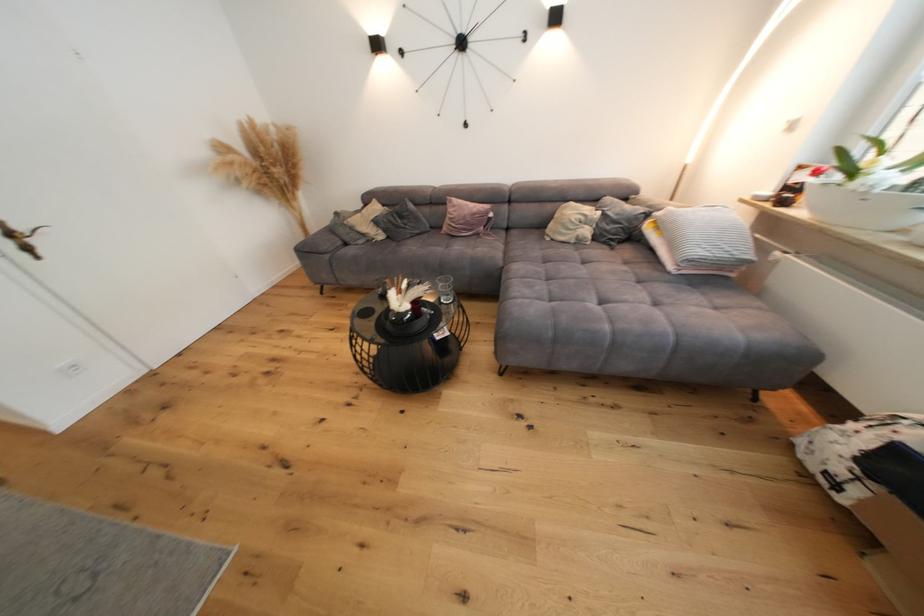
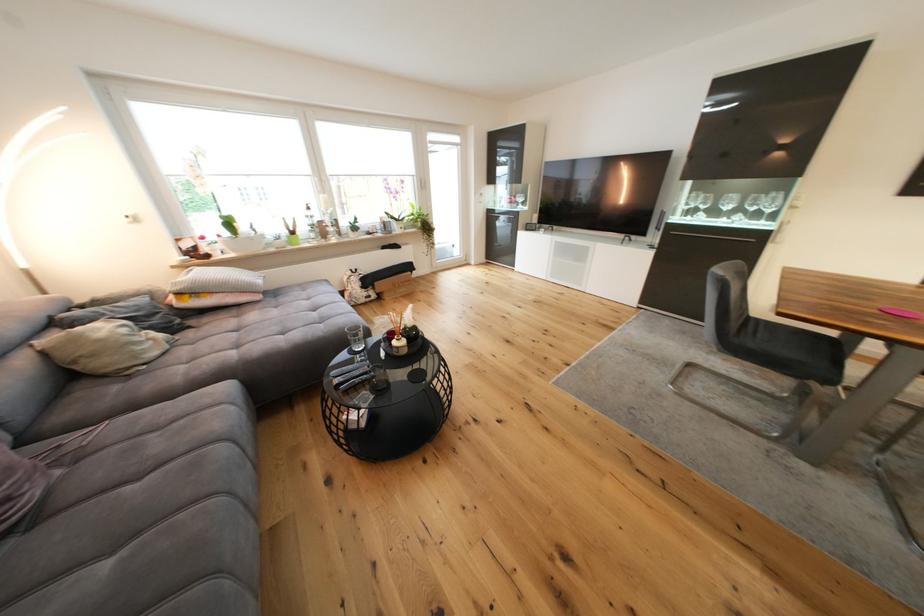
The point at (473, 225) is marked in the first image. Where is the corresponding point in the second image?

(18, 469)